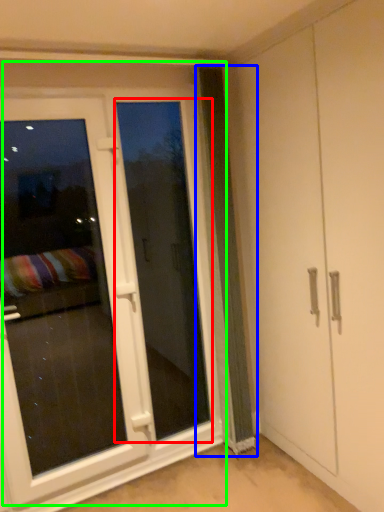
Question: Which object is the farthest from screen door (highlighted by a red box)? Choose among these: curtain (highlighted by a blue box) or door (highlighted by a green box).

Choices:
 (A) curtain
 (B) door

Answer: (A)